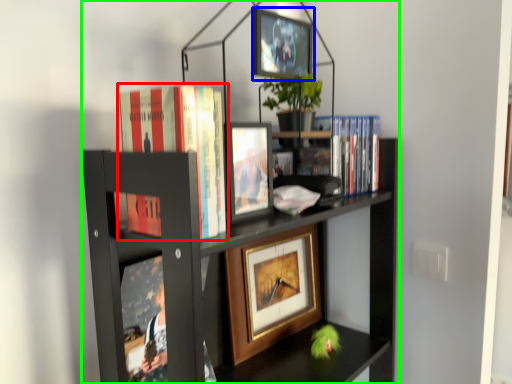
Question: Estimate the real-world distances between objects in this image. Which object is farther from book (highlighted by a red box), picture frame (highlighted by a blue box) or bookcase (highlighted by a green box)?

Choices:
 (A) picture frame
 (B) bookcase

Answer: (A)